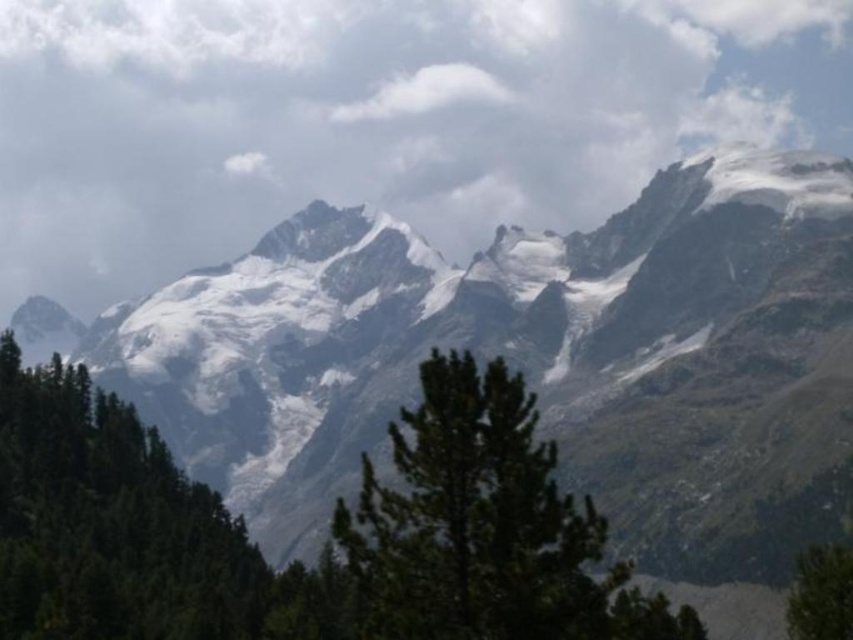
Question: Does white snow-covered mountain range at center come in front of white fluffy cloud at upper center?

Choices:
 (A) yes
 (B) no

Answer: (A)

Question: Which point is closer to the camera?

Choices:
 (A) (x=344, y=67)
 (B) (x=653, y=545)
 (C) (x=822, y=570)

Answer: (C)

Question: Can you confirm if white fluffy cloud at upper center is positioned below green textured tree at center?

Choices:
 (A) no
 (B) yes

Answer: (A)

Question: Does white fluffy cloud at upper center have a larger size compared to green matte tree at left?

Choices:
 (A) yes
 (B) no

Answer: (A)

Question: Among these points, which one is nearest to the camera?

Choices:
 (A) (804, 593)
 (B) (438, 596)

Answer: (B)

Question: Which object is closer to the camera taking this photo?

Choices:
 (A) green matte tree at left
 (B) white snow-covered mountain range at center
 (C) green textured tree at center
 (D) green matte tree at lower right

Answer: (C)